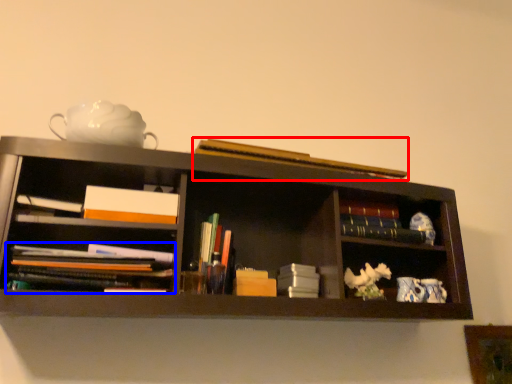
Question: Among these objects, which one is nearest to the camera, book (highlighted by a red box) or book (highlighted by a blue box)?

Choices:
 (A) book
 (B) book

Answer: (B)